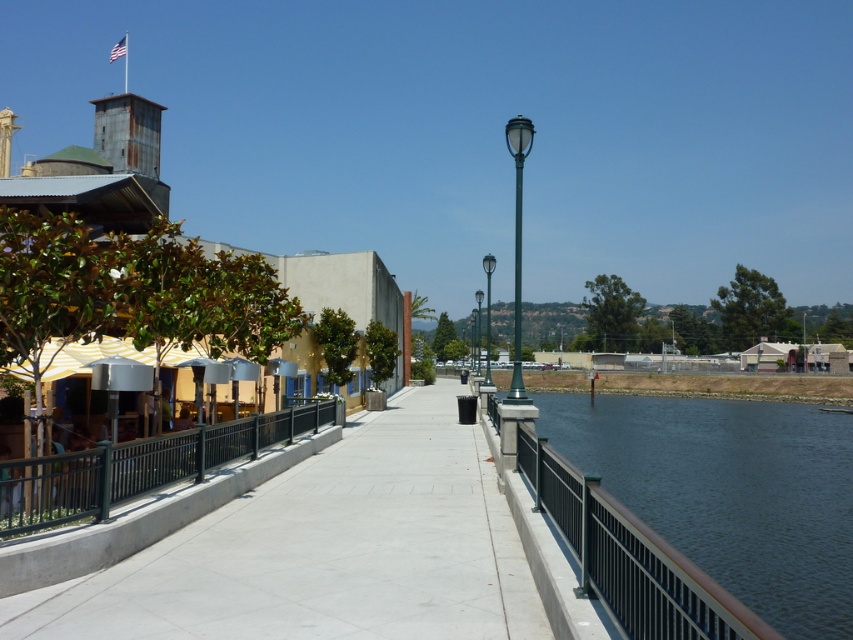
Question: Can you confirm if concrete at center is bigger than dark blue water at center?

Choices:
 (A) no
 (B) yes

Answer: (A)

Question: Which point is closer to the camera taking this photo?

Choices:
 (A) (18, 531)
 (B) (730, 432)
 (C) (512, 401)

Answer: (A)

Question: Is green metallic streetlight at center-right wider than green metallic pole at center?

Choices:
 (A) no
 (B) yes

Answer: (B)

Question: Is concrete at center thinner than black metal railing at lower left?

Choices:
 (A) yes
 (B) no

Answer: (B)

Question: Which object appears closest to the camera in this image?

Choices:
 (A) dark blue water at center
 (B) green metallic streetlight at center
 (C) concrete at center

Answer: (A)

Question: Considering the real-world distances, which object is closest to the green metallic streetlight at center-right?

Choices:
 (A) green metallic pole at center
 (B) concrete at center

Answer: (A)